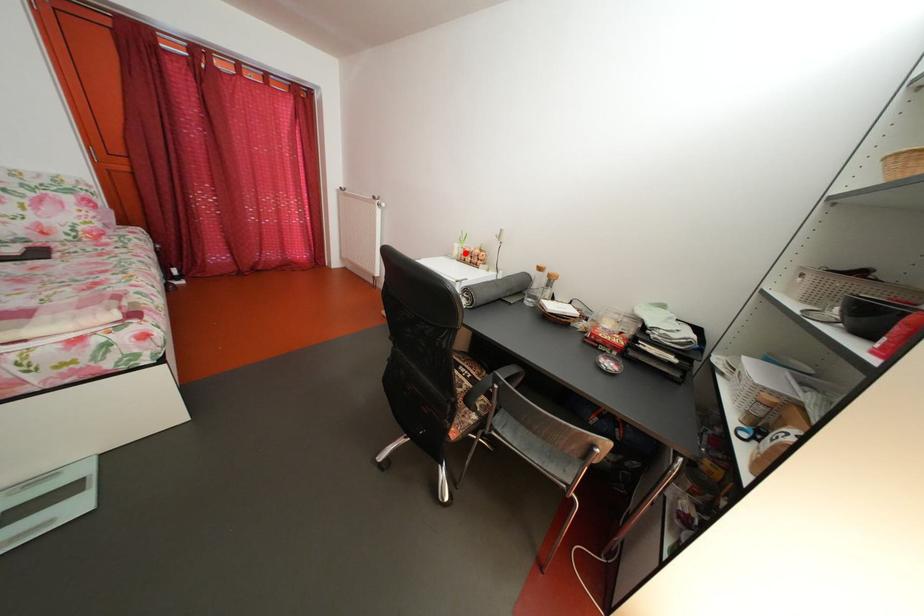
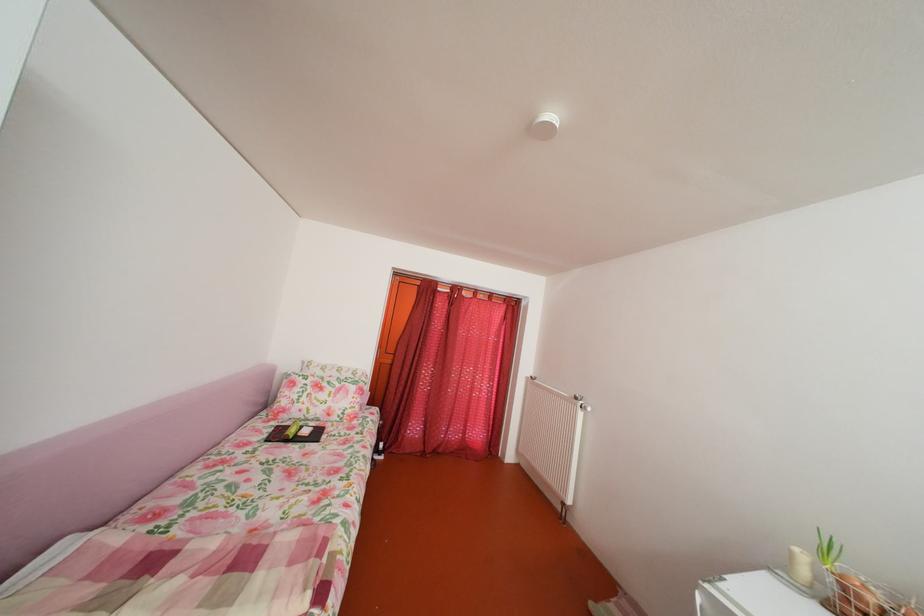
Find the pixel in the second image that matches the highlighted location in the first image.

(803, 561)